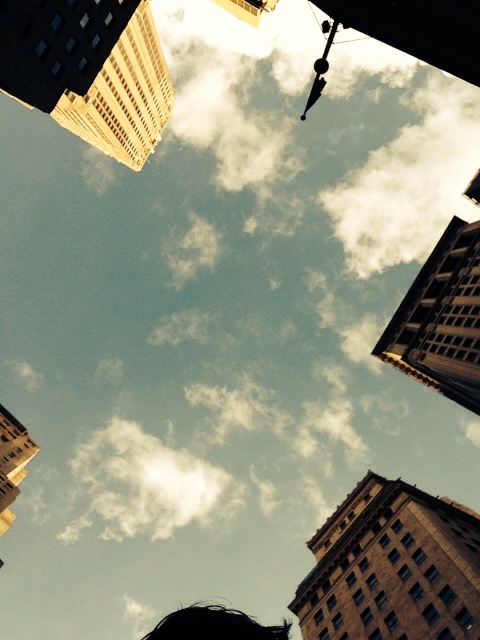
Question: Which point is farther to the camera?

Choices:
 (A) (178, 509)
 (B) (201, 616)

Answer: (A)

Question: Considering the relative positions of white fluffy cloud at center and black hair at lower center in the image provided, where is white fluffy cloud at center located with respect to black hair at lower center?

Choices:
 (A) right
 (B) left

Answer: (B)

Question: Which point is farther to the camera?

Choices:
 (A) (232, 620)
 (B) (214, 492)

Answer: (B)

Question: Is white fluffy cloud at center closer to the viewer compared to black hair at lower center?

Choices:
 (A) no
 (B) yes

Answer: (A)

Question: Is white fluffy cloud at center to the right of black hair at lower center from the viewer's perspective?

Choices:
 (A) yes
 (B) no

Answer: (B)